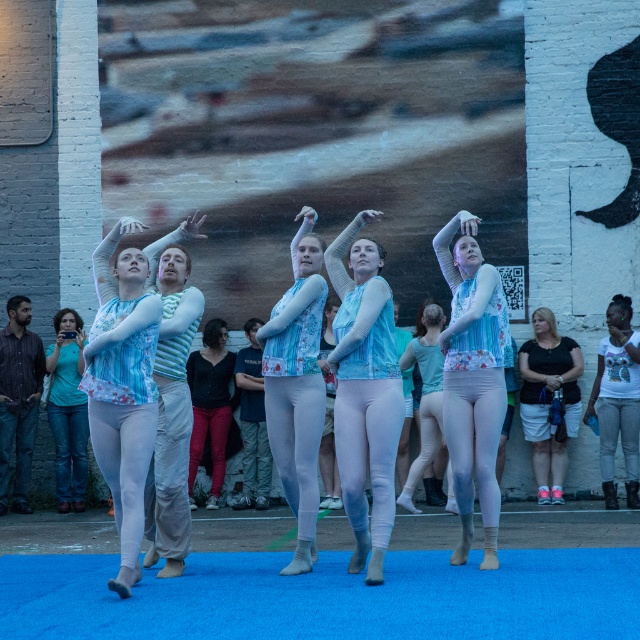
You are a photographer standing at the center of the scene. You want to capture a photo where both points, point (497, 515) and point (412, 339), are clearly visible. Since one point is closer to you, will you need to adjust your focus to ensure both are sharp?

Point (497, 515) is closer to the camera than point (412, 339). To ensure both points are sharp, you may need to adjust the focus range or use a smaller aperture for greater depth of field.